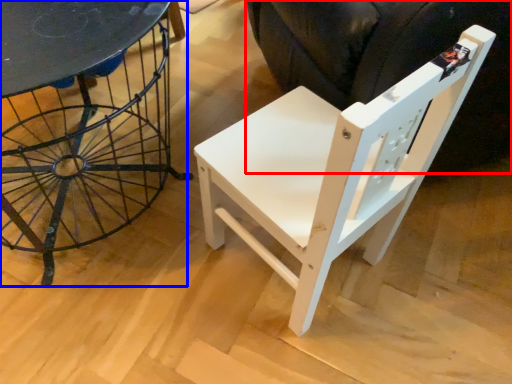
Question: Which point is closer to the camera, swivel chair (highlighted by a red box) or table (highlighted by a blue box)?

Choices:
 (A) swivel chair
 (B) table

Answer: (B)